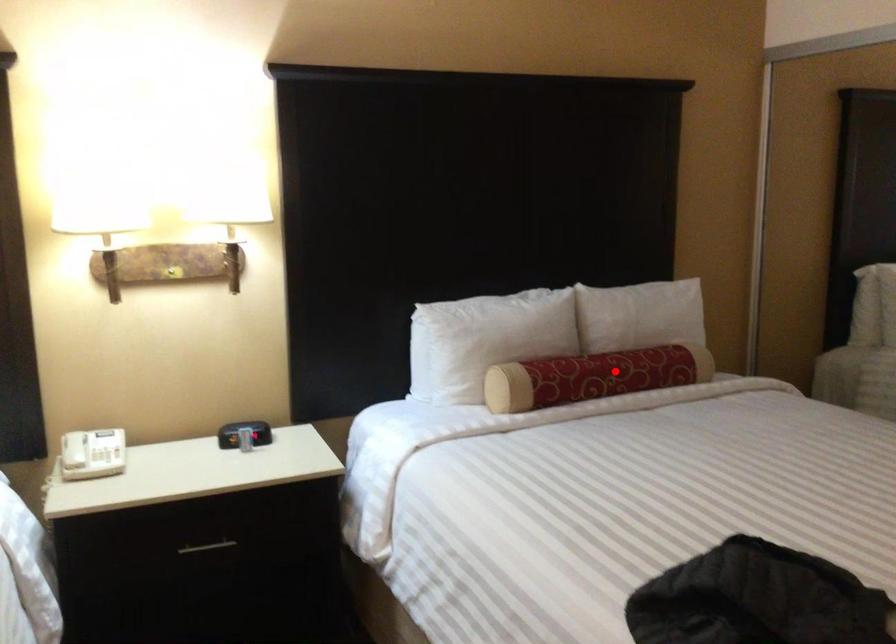
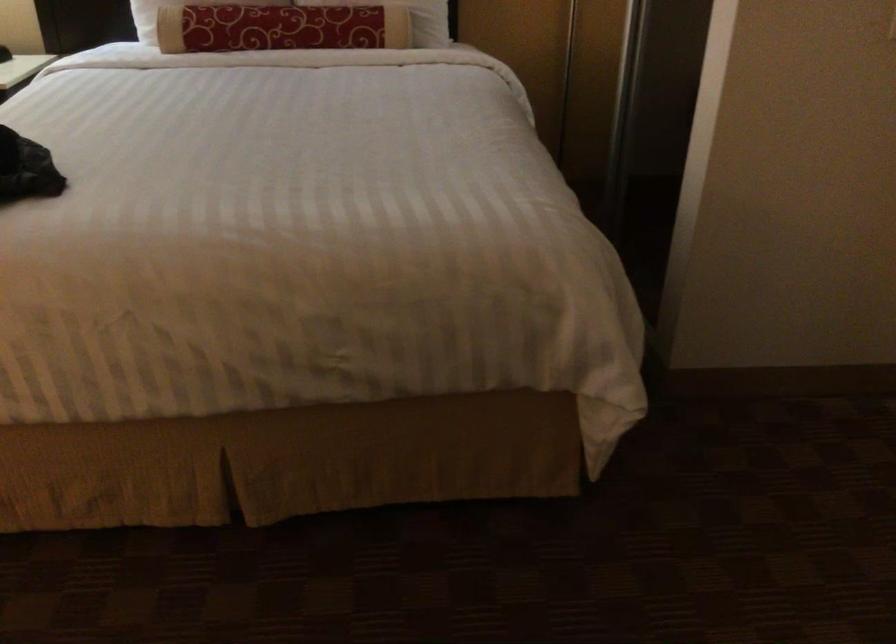
Find the pixel in the second image that matches the highlighted location in the first image.

(280, 28)